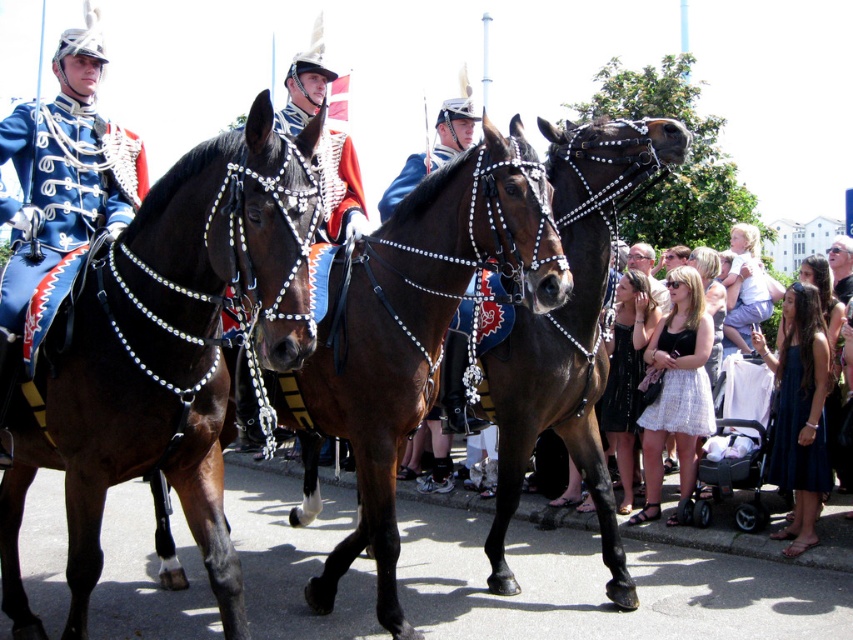
Question: Which point appears farthest from the camera in this image?

Choices:
 (A) (428, 260)
 (B) (477, 120)
 (C) (709, 273)

Answer: (C)

Question: Is shiny brown horse at center to the left of black satin dress at center from the viewer's perspective?

Choices:
 (A) yes
 (B) no

Answer: (A)

Question: Where is navy satin dress at lower right located in relation to white lace dress at lower right in the image?

Choices:
 (A) left
 (B) right

Answer: (B)

Question: Among these objects, which one is nearest to the camera?

Choices:
 (A) white lace dress at lower right
 (B) brown glossy horse at center
 (C) white cotton dress at lower right

Answer: (B)

Question: Which point is closer to the camera taking this photo?

Choices:
 (A) (630, 378)
 (B) (654, 349)
 (C) (27, 148)
 (D) (509, 204)

Answer: (D)

Question: Is shiny brown horse at center in front of white cotton dress at lower right?

Choices:
 (A) yes
 (B) no

Answer: (A)